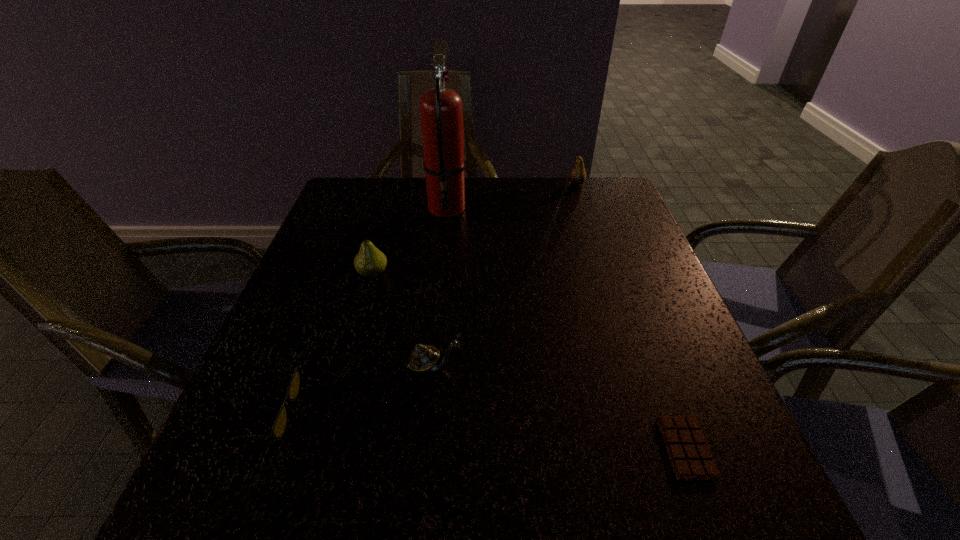
At what (x,y) coordinates should I click in order to perform the action: click on vacant space at the near left corner. Please return your answer as a coordinate pair (x, y). Looking at the image, I should click on (192, 528).

You are a GUI agent. You are given a task and a screenshot of the screen. Output one action in this format:
    pyautogui.click(x=<x>, y=<y>)
    Task: Click on the free region at the far right corner of the desktop
    
    Given the screenshot: What is the action you would take?
    pyautogui.click(x=592, y=206)

This screenshot has width=960, height=540. Find the location of `unoccupied area between the tallest object and the farther pear`. unoccupied area between the tallest object and the farther pear is located at coordinates (512, 195).

Locate an element on the screen. The height and width of the screenshot is (540, 960). vacant area that lies between the fifth object from right to left and the shortest object is located at coordinates (529, 361).

Locate an element on the screen. The width and height of the screenshot is (960, 540). vacant area that lies between the shortest object and the farther pear is located at coordinates (632, 315).

I want to click on free spot between the snail and the second farthest object, so click(442, 287).

This screenshot has width=960, height=540. In order to click on vacant space that's between the fourth farthest object and the candy bar in this screenshot , I will do `click(561, 407)`.

The height and width of the screenshot is (540, 960). Find the location of `empty space between the snail and the fifth object from right to left`. empty space between the snail and the fifth object from right to left is located at coordinates (404, 320).

Locate an element on the screen. The width and height of the screenshot is (960, 540). vacant point located between the farther pear and the tallest object is located at coordinates (512, 195).

This screenshot has width=960, height=540. I want to click on free spot between the third nearest object and the right pear, so click(506, 275).